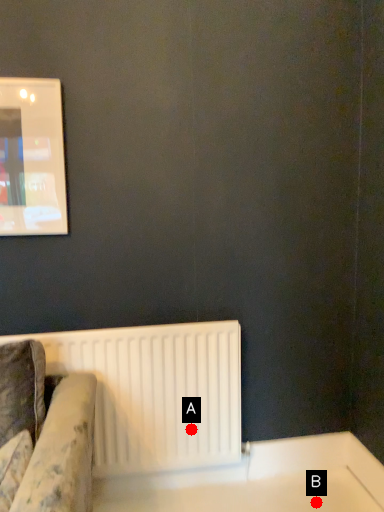
Question: Two points are circled on the image, labeled by A and B beside each circle. Which point is closer to the camera?

Choices:
 (A) A is closer
 (B) B is closer

Answer: (B)